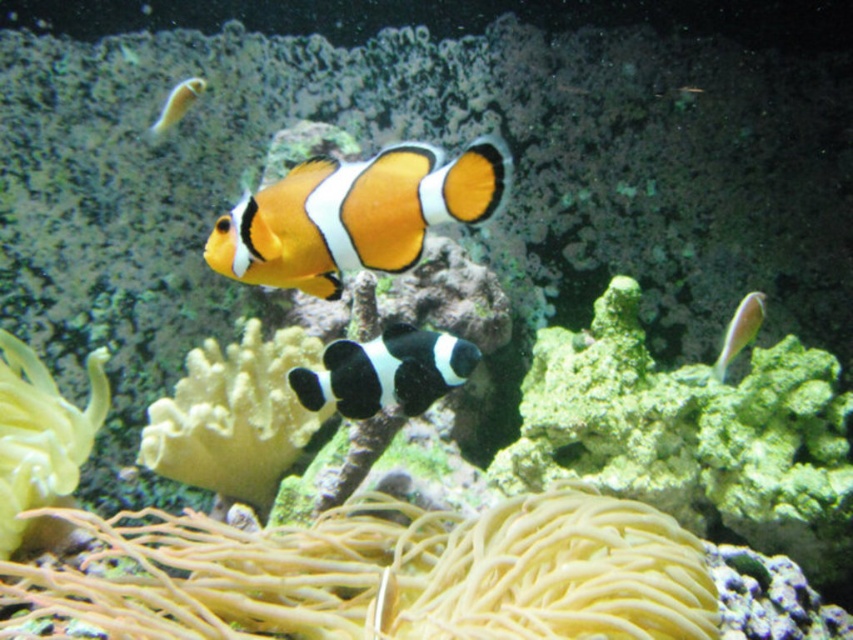
Is point (355, 364) less distant than point (189, 100)?

Yes, it is in front of point (189, 100).

What do you see at coordinates (386, 372) in the screenshot? The image size is (853, 640). I see `black matte clownfish at center` at bounding box center [386, 372].

Who is more distant from viewer, (347, 394) or (177, 100)?

Positioned behind is point (177, 100).

This screenshot has height=640, width=853. I want to click on black matte clownfish at center, so click(386, 372).

Which of these two, orange and black clownfish at center or black matte clownfish at center, stands taller?

With more height is orange and black clownfish at center.

Is orange and black clownfish at center wider than black matte clownfish at center?

Correct, the width of orange and black clownfish at center exceeds that of black matte clownfish at center.

Describe the element at coordinates (354, 214) in the screenshot. The width and height of the screenshot is (853, 640). I see `orange and black clownfish at center` at that location.

Identify the location of orange and black clownfish at center. The height and width of the screenshot is (640, 853). (354, 214).

Does point (408, 356) come in front of point (761, 305)?

Yes, it is in front of point (761, 305).

Which is more to the right, black matte clownfish at center or pink glossy fish at right?

Positioned to the right is pink glossy fish at right.

Who is more distant from viewer, (345,372) or (763,312)?

Point (763,312)

Where is `black matte clownfish at center`? black matte clownfish at center is located at coordinates (386, 372).